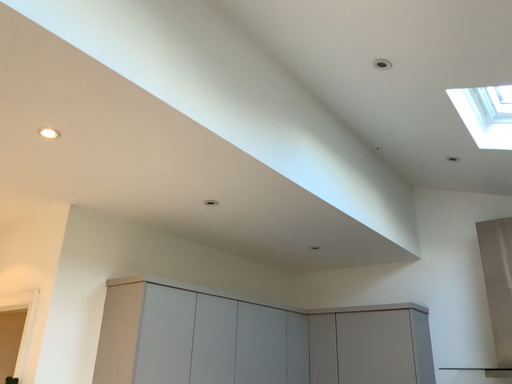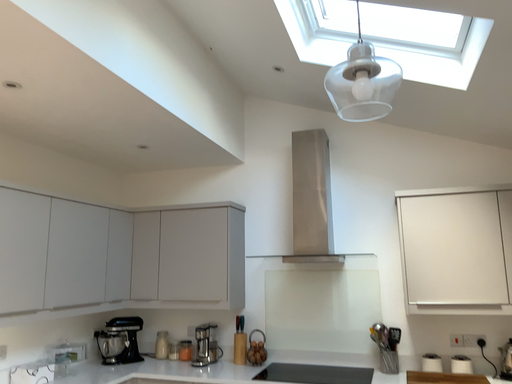
Question: Which way did the camera rotate in the video?

Choices:
 (A) rotated downward
 (B) rotated upward

Answer: (A)